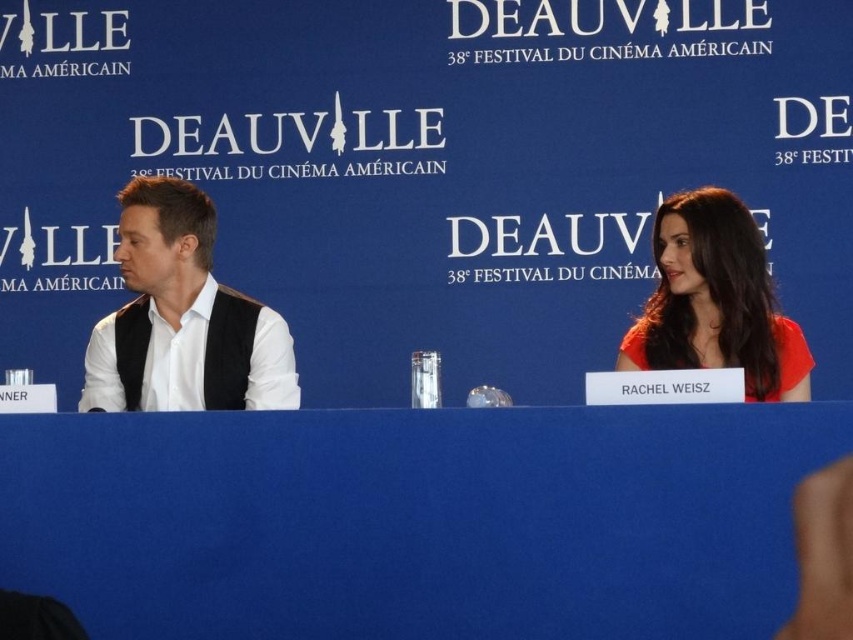
In the scene shown: You are a photographer at the 38th Deauville American Film Festival. You need to take a photo of the white matte vest at left and the matte red dress at right. Which object should you focus on first if you want to capture both in the frame without moving the camera?

You should focus on the white matte vest at left first because it is larger than the matte red dress at right, so it will occupy more space in the frame and ensure both are visible.

You are attending the 38th Deauville American Film Festival and want to sit at the blue fabric table at center. Based on its 2D location coordinates, can you estimate where exactly the table is positioned in the image?

The blue fabric table at center is positioned at the coordinates point 0.814 on the x axis and 0.487 on the y axis.

You are attending the 38th Deauville American Film Festival and notice the blue fabric table at center and the white matte vest at left. Which object is lower in height?

The blue fabric table at center has a lesser height compared to the white matte vest at left, so the blue fabric table at center is lower in height.